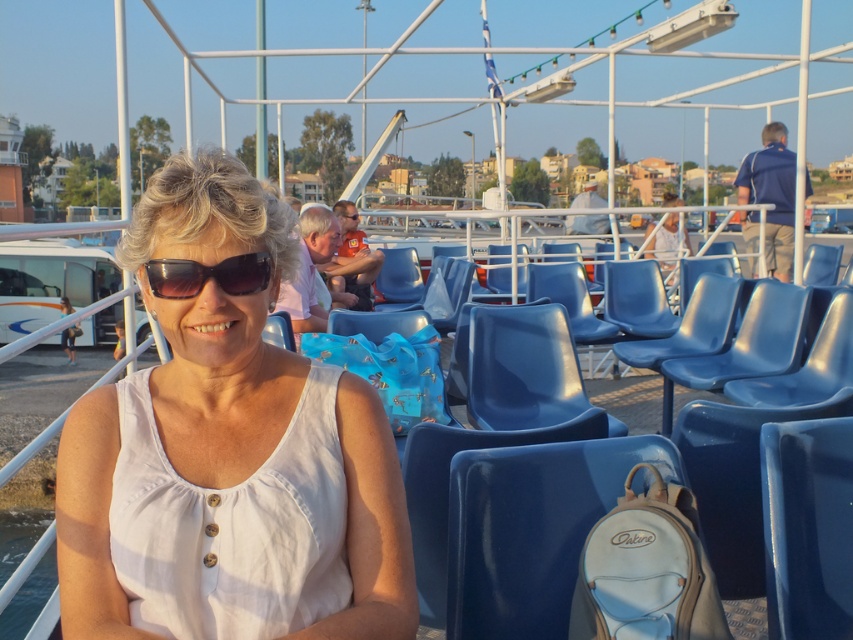
Question: Which point is closer to the camera?

Choices:
 (A) pos(347,218)
 (B) pos(503,618)
 (C) pos(241,262)

Answer: (C)

Question: Does white leather backpack at lower center lie in front of black plastic sunglasses at center?

Choices:
 (A) yes
 (B) no

Answer: (B)

Question: Which object is the farthest from the black plastic sunglasses at center?

Choices:
 (A) black plastic goggles at center
 (B) white cotton tank top at center
 (C) white leather backpack at lower center

Answer: (A)

Question: Does white cotton tank top at center have a smaller size compared to black plastic goggles at center?

Choices:
 (A) yes
 (B) no

Answer: (B)

Question: Considering the real-world distances, which object is farthest from the white cotton tank top at center?

Choices:
 (A) black plastic goggles at center
 (B) black plastic sunglasses at center

Answer: (A)

Question: Can you confirm if white leather backpack at lower center is thinner than black plastic sunglasses at center?

Choices:
 (A) yes
 (B) no

Answer: (B)